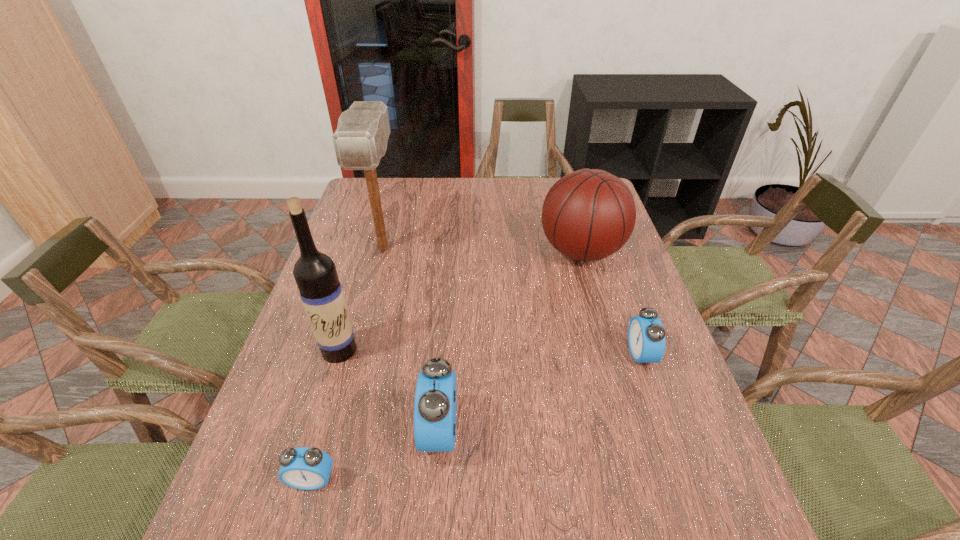
This screenshot has width=960, height=540. I want to click on alarm clock that stands as the closest to the shortest object, so click(x=435, y=406).

This screenshot has width=960, height=540. Identify the location of vacant area in the image that satisfies the following two spatial constraints: 1. on the face of the rightmost alarm clock; 2. on the face of the leftmost alarm clock. tap(684, 480).

Locate an element on the screen. Image resolution: width=960 pixels, height=540 pixels. vacant space that satisfies the following two spatial constraints: 1. on the face of the fifth tallest object; 2. on the face of the leftmost alarm clock is located at coordinates (684, 480).

The image size is (960, 540). In order to click on vacant position in the image that satisfies the following two spatial constraints: 1. on the face of the fourth object from left to right; 2. on the face of the leftmost alarm clock in this screenshot , I will do `click(436, 480)`.